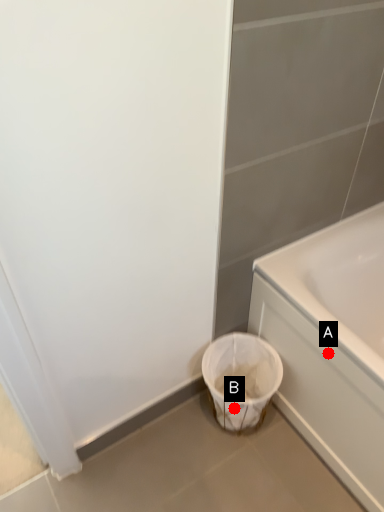
Question: Two points are circled on the image, labeled by A and B beside each circle. Which of the following is the farthest from the observer?

Choices:
 (A) A is further
 (B) B is further

Answer: (B)